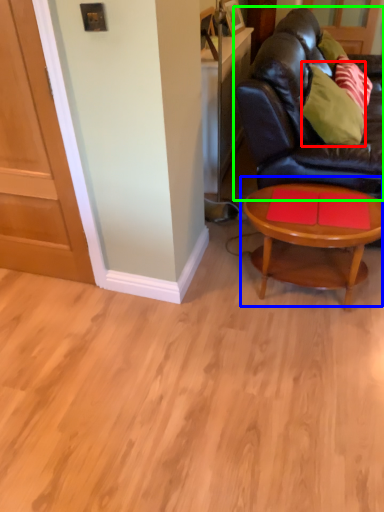
Question: Which is nearer to the pillow (highlighted by a red box)? coffee table (highlighted by a blue box) or studio couch (highlighted by a green box).

Choices:
 (A) coffee table
 (B) studio couch

Answer: (B)